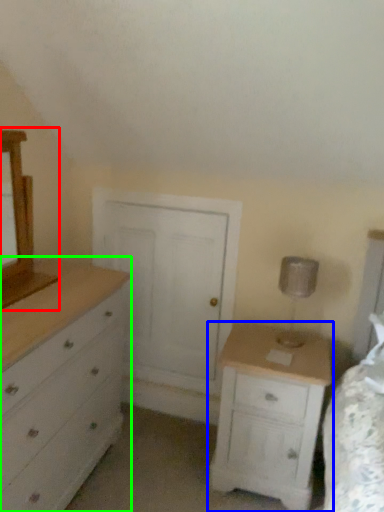
Question: Estimate the real-world distances between objects in this image. Which object is farther from medicine cabinet (highlighted by a red box), nightstand (highlighted by a blue box) or chest of drawers (highlighted by a green box)?

Choices:
 (A) nightstand
 (B) chest of drawers

Answer: (A)